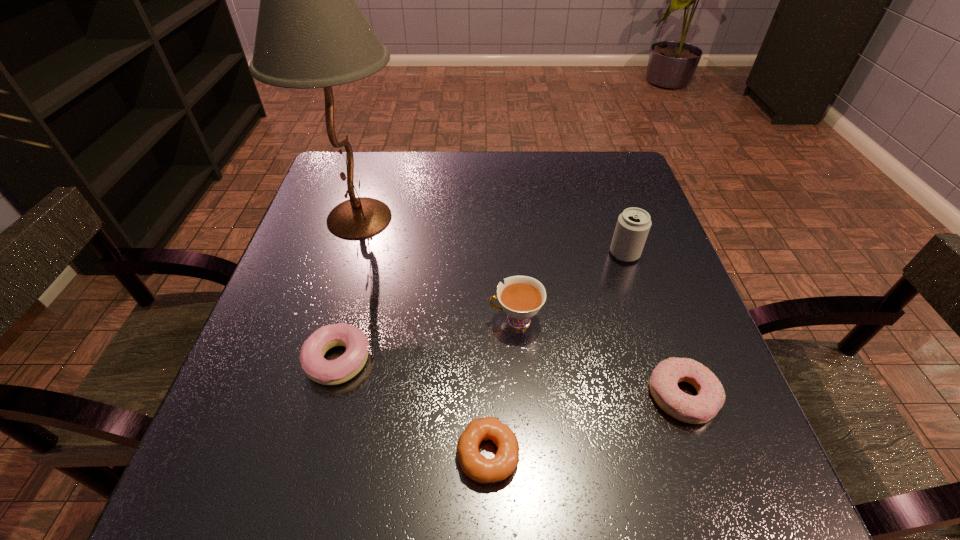
This screenshot has width=960, height=540. I want to click on table lamp, so click(x=311, y=33).

The image size is (960, 540). Find the location of `can`. can is located at coordinates (633, 224).

Locate an element on the screen. the fourth shortest object is located at coordinates (521, 297).

Locate an element on the screen. This screenshot has height=540, width=960. the leftmost doughnut is located at coordinates (327, 372).

Where is `the rightmost doughnut`? This screenshot has height=540, width=960. the rightmost doughnut is located at coordinates (710, 398).

At what (x,y) coordinates should I click in order to perform the action: click on the second doughnut from left to right. Please return your answer as a coordinate pair (x, y). The height and width of the screenshot is (540, 960). Looking at the image, I should click on (478, 468).

Find the location of a particular element. This screenshot has height=540, width=960. vacant space located on the front-facing side of the tallest object is located at coordinates (566, 218).

Where is `vacant space located 0.200m on the front of the can`? vacant space located 0.200m on the front of the can is located at coordinates (654, 341).

Where is `vacant point located on the side of the teacup with the handle`? The height and width of the screenshot is (540, 960). vacant point located on the side of the teacup with the handle is located at coordinates (290, 320).

Identify the location of vacant space situated on the side of the teacup with the handle. (373, 320).